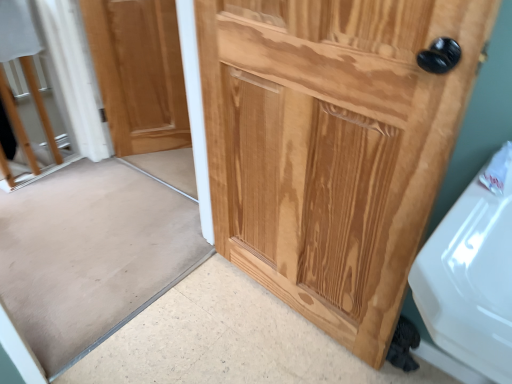
Identify the location of vacant area to the left of natural wood door at right, which is the second door from back to front. This screenshot has height=384, width=512. (203, 323).